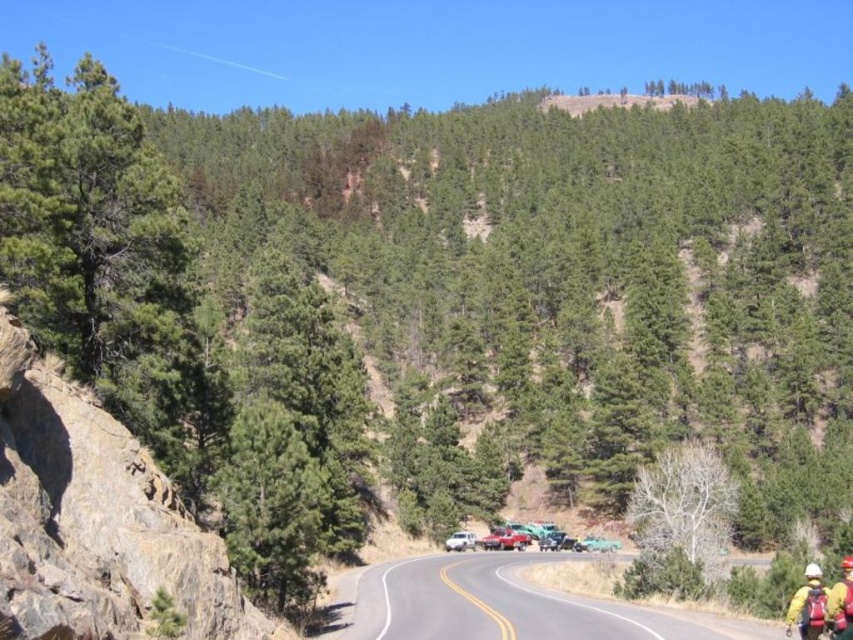
Question: Which point appears farthest from the camera in this image?

Choices:
 (A) (840, 579)
 (B) (521, 625)
 (C) (802, 588)

Answer: (A)

Question: Which object is farther from the camera taking this photo?

Choices:
 (A) yellow reflective vest at lower right
 (B) yellow fabric helmet at lower right
 (C) smooth asphalt road at center

Answer: (C)

Question: Is smooth asphalt road at center below yellow reflective vest at lower right?

Choices:
 (A) no
 (B) yes

Answer: (B)

Question: Does smooth asphalt road at center lie in front of yellow fabric helmet at lower right?

Choices:
 (A) yes
 (B) no

Answer: (B)

Question: Which point appears farthest from the camera in this image?

Choices:
 (A) (549, 611)
 (B) (849, 612)

Answer: (A)

Question: Can you confirm if smooth asphalt road at center is wider than yellow fabric helmet at lower right?

Choices:
 (A) yes
 (B) no

Answer: (A)